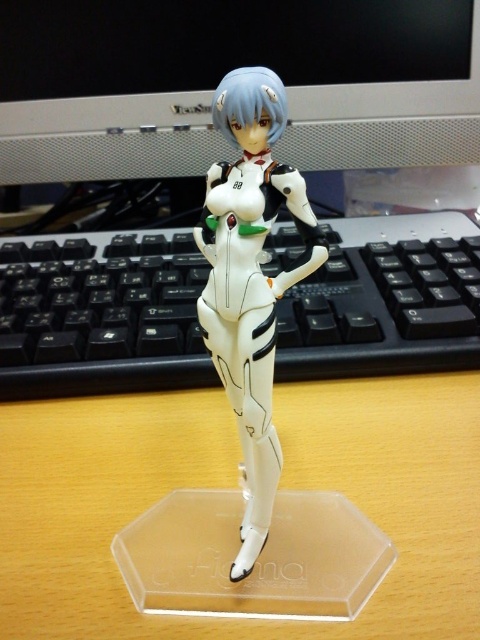
You are setting up a display for a sci fi convention. You have a matte black monitor at upper center and a white glossy figure at center. According to the image, which object is positioned to the left of the other?

The matte black monitor at upper center is positioned to the left of the white glossy figure at center.

You are setting up a display for a convention booth. You have a clear wood table at center and a matte black monitor at upper center. Which object should you adjust first if you need to make space for a larger figurine that requires more room on the closer surface?

The clear wood table at center is closer to the viewer than the matte black monitor at upper center, so you should adjust the matte black monitor at upper center first to free up space on the closer table.

You are setting up a desk for a video game tournament. You have a black plastic keyboard at center and a matte black monitor at upper center. The tournament requires that the distance between the keyboard and monitor must be exactly 12 inches to ensure proper ergonomic setup. Can the current setup meet this requirement?

The black plastic keyboard at center and matte black monitor at upper center are 13.14 inches apart, which is more than the required 12 inches. Therefore, the current setup does not meet the tournament requirement.